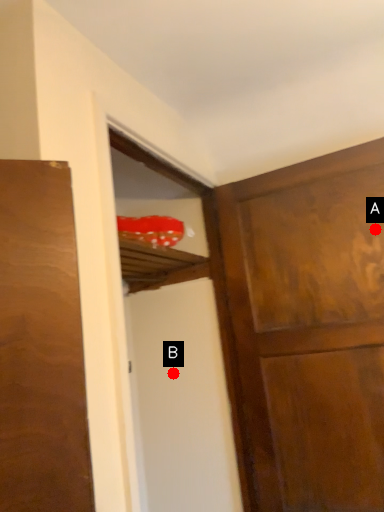
Question: Two points are circled on the image, labeled by A and B beside each circle. Which point is farther to the camera?

Choices:
 (A) A is further
 (B) B is further

Answer: (B)